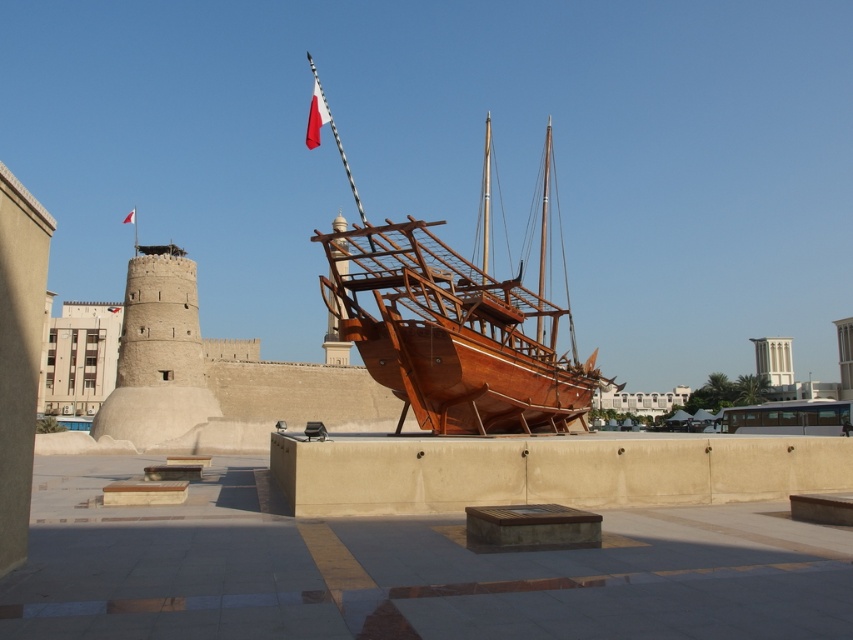
You are standing in the public square and want to take a photo of the wooden ship at center and the white fabric flag at upper center. Which object will appear larger in your photo?

The wooden ship at center will appear larger in the photo because it is closer to the viewer than the white fabric flag at upper center.

You are a visitor at the square and want to take a photo of the wooden ship at center. The white fabric flag at upper center is blocking the view. Can you move to a position where the flag is no longer in front of the ship?

The wooden ship at center is positioned under the white fabric flag at upper center, so moving to a position where the flag is no longer in front of the ship would require positioning yourself such that the flag is either to the side or behind the ship relative to your viewpoint. Since the flag is above the ship, moving to a lower viewpoint or shifting laterally might allow you to avoid the flag blocking the view.

You are a visitor at the historical site and want to take a photo of both the wooden ship at center and the red fabric flag at upper center. Which object should you focus on first to ensure both are in frame?

The wooden ship at center is taller than the red fabric flag at upper center, so you should focus on the wooden ship at center first to ensure both are in frame.